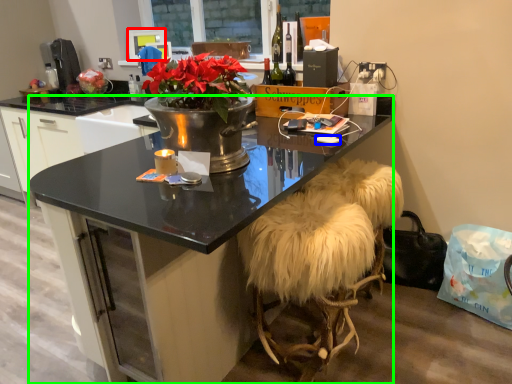
Question: Estimate the real-world distances between objects in this image. Which object is farther from television (highlighted by a red box), mobile phone (highlighted by a blue box) or desk (highlighted by a green box)?

Choices:
 (A) mobile phone
 (B) desk

Answer: (A)